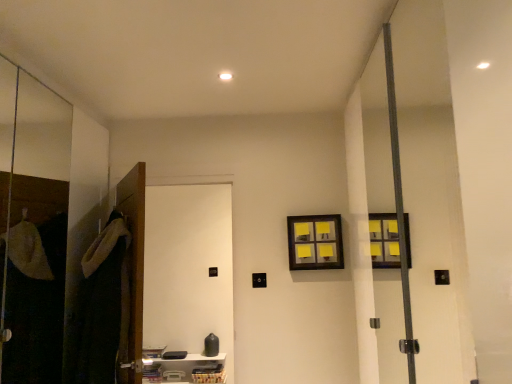
Question: Is yellow sticky notes at upper center positioned far away from white matte door at left, marked as the 1th screen door in a right-to-left arrangement?

Choices:
 (A) yes
 (B) no

Answer: (A)

Question: From a real-world perspective, is yellow sticky notes at upper center below white matte door at left, which is the 2th screen door in left-to-right order?

Choices:
 (A) no
 (B) yes

Answer: (A)

Question: Can you confirm if yellow sticky notes at upper center is positioned to the left of white matte door at left, marked as the 1th screen door in a right-to-left arrangement?

Choices:
 (A) yes
 (B) no

Answer: (B)

Question: Considering the relative sizes of yellow sticky notes at upper center and white matte door at left, marked as the 1th screen door in a right-to-left arrangement, in the image provided, is yellow sticky notes at upper center wider than white matte door at left, marked as the 1th screen door in a right-to-left arrangement,?

Choices:
 (A) yes
 (B) no

Answer: (B)

Question: Does yellow sticky notes at upper center lie behind white matte door at left, marked as the 1th screen door in a right-to-left arrangement?

Choices:
 (A) yes
 (B) no

Answer: (A)

Question: Is yellow sticky notes at upper center taller than white matte door at left, marked as the 1th screen door in a right-to-left arrangement?

Choices:
 (A) no
 (B) yes

Answer: (A)

Question: Is white plastic shelf at lower center to the left of transparent glass screen door at left, arranged as the first screen door when viewed from the left, from the viewer's perspective?

Choices:
 (A) yes
 (B) no

Answer: (B)

Question: Is white plastic shelf at lower center shorter than transparent glass screen door at left, arranged as the first screen door when viewed from the left?

Choices:
 (A) no
 (B) yes

Answer: (B)

Question: Is white plastic shelf at lower center closer to camera compared to transparent glass screen door at left, the second screen door viewed from the right?

Choices:
 (A) no
 (B) yes

Answer: (A)

Question: Is there a large distance between white plastic shelf at lower center and transparent glass screen door at left, arranged as the first screen door when viewed from the left?

Choices:
 (A) yes
 (B) no

Answer: (A)

Question: Can you confirm if white plastic shelf at lower center is taller than transparent glass screen door at left, the second screen door viewed from the right?

Choices:
 (A) yes
 (B) no

Answer: (B)

Question: Is white plastic shelf at lower center behind transparent glass screen door at left, arranged as the first screen door when viewed from the left?

Choices:
 (A) yes
 (B) no

Answer: (A)

Question: Is transparent glass screen door at left, arranged as the first screen door when viewed from the left, surrounding yellow sticky notes at upper center?

Choices:
 (A) yes
 (B) no

Answer: (B)